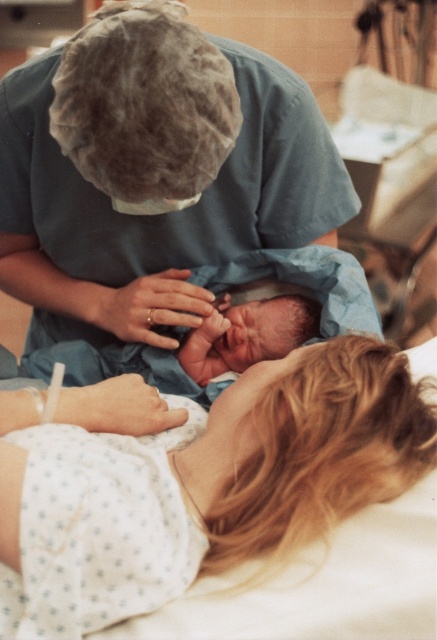
Question: Among these objects, which one is nearest to the camera?

Choices:
 (A) smooth skin newborn at center
 (B) matte blue scrubs at center
 (C) white dotted fabric at lower left

Answer: (C)

Question: Does white dotted fabric at lower left have a lesser width compared to matte blue scrubs at center?

Choices:
 (A) yes
 (B) no

Answer: (A)

Question: Among these points, which one is nearest to the camera?

Choices:
 (A) (239, 244)
 (B) (222, 346)
 (C) (250, 401)

Answer: (C)

Question: Which object appears closest to the camera in this image?

Choices:
 (A) white dotted fabric at lower left
 (B) smooth skin newborn at center
 (C) matte blue scrubs at center

Answer: (A)

Question: Can you confirm if white dotted fabric at lower left is positioned to the right of smooth skin newborn at center?

Choices:
 (A) no
 (B) yes

Answer: (B)

Question: Is white dotted fabric at lower left smaller than matte blue scrubs at center?

Choices:
 (A) no
 (B) yes

Answer: (B)